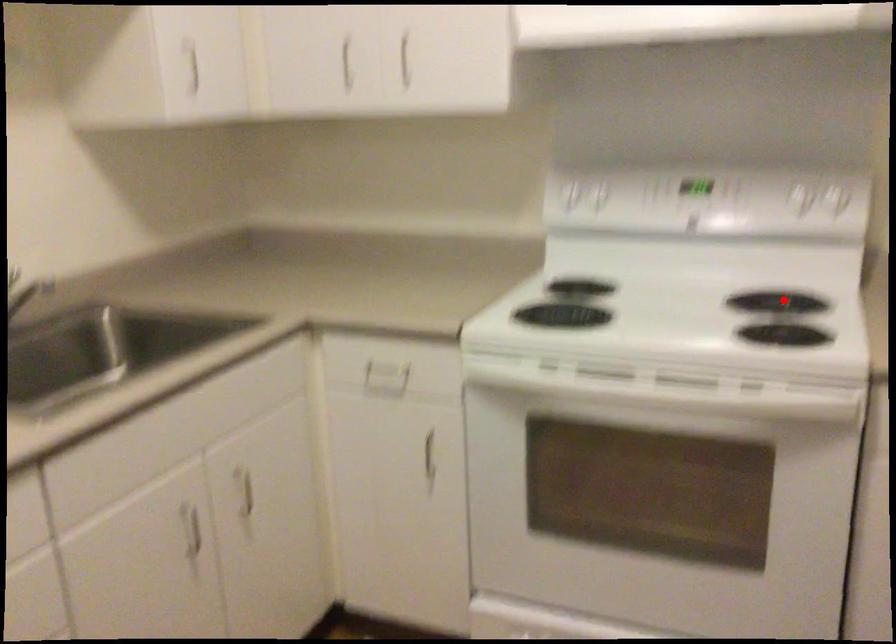
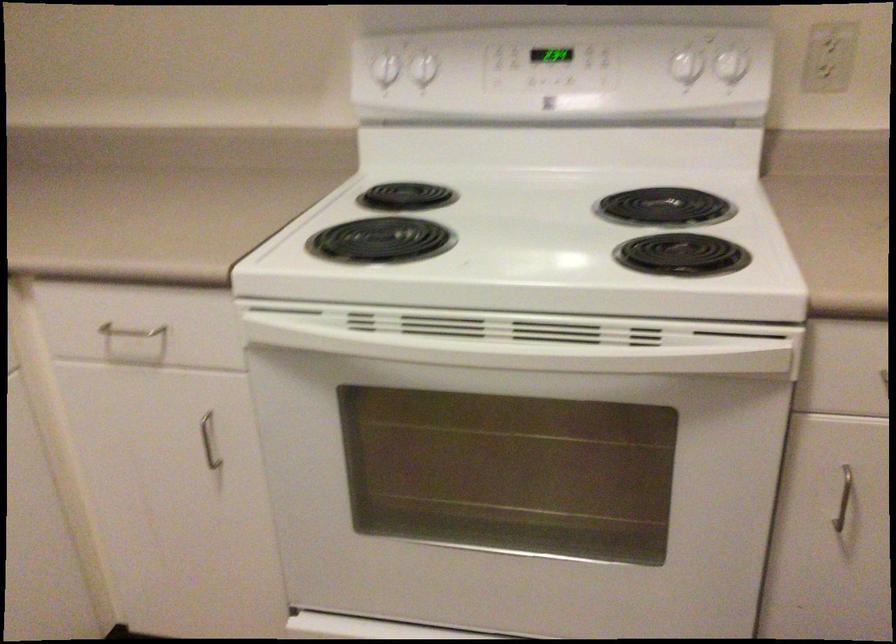
In the second image, find the point that corresponds to the highlighted location in the first image.

(664, 207)